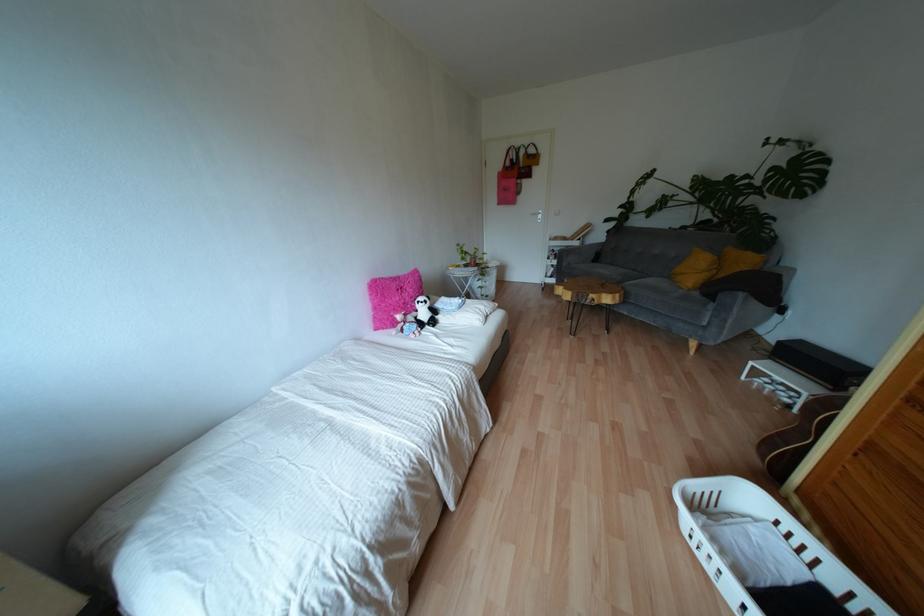
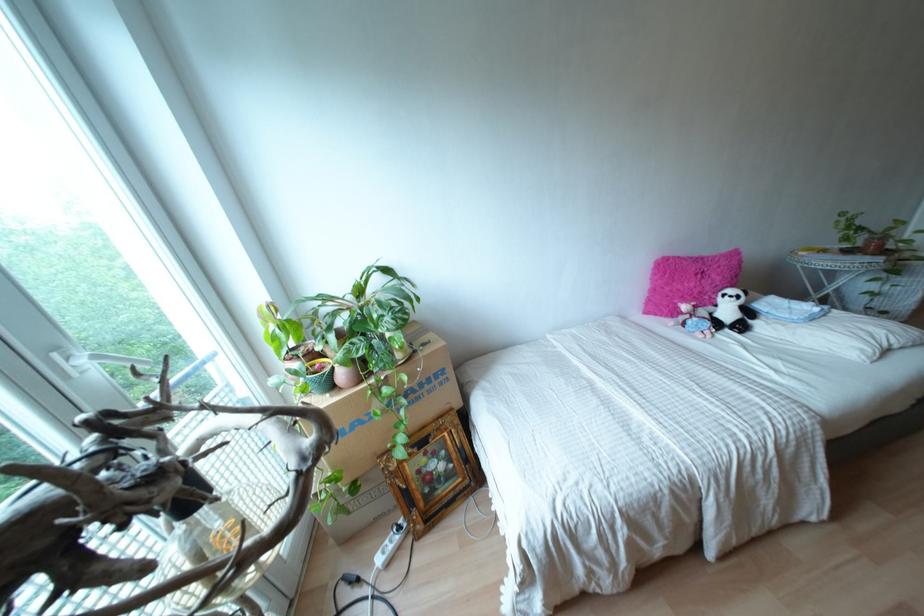
In the second image, find the point that corresponds to [463,257] in the first image.

(845, 238)